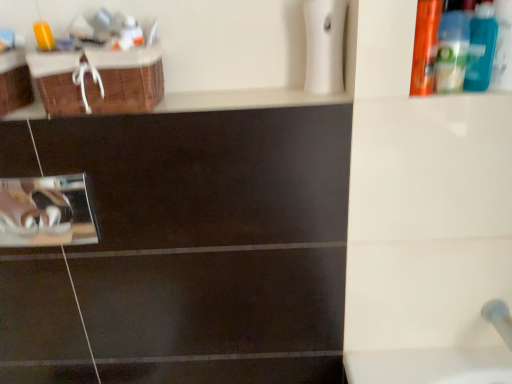
Question: Does translucent plastic mouthwash at upper left, positioned as the fourth mouthwash in right-to-left order, have a smaller size compared to blue plastic bottle at upper right, arranged as the first mouthwash when viewed from the right?

Choices:
 (A) no
 (B) yes

Answer: (B)

Question: Can you confirm if translucent plastic mouthwash at upper left, which ranks as the first mouthwash in left-to-right order, is wider than blue plastic bottle at upper right, the fourth mouthwash in the left-to-right sequence?

Choices:
 (A) yes
 (B) no

Answer: (B)

Question: Is translucent plastic mouthwash at upper left, which ranks as the first mouthwash in left-to-right order, at the left side of blue plastic bottle at upper right, the fourth mouthwash in the left-to-right sequence?

Choices:
 (A) no
 (B) yes

Answer: (B)

Question: Is translucent plastic mouthwash at upper left, which ranks as the first mouthwash in left-to-right order, facing away from blue plastic bottle at upper right, the fourth mouthwash in the left-to-right sequence?

Choices:
 (A) no
 (B) yes

Answer: (A)

Question: Is translucent plastic mouthwash at upper left, positioned as the fourth mouthwash in right-to-left order, far away from blue plastic bottle at upper right, arranged as the first mouthwash when viewed from the right?

Choices:
 (A) no
 (B) yes

Answer: (A)

Question: From a real-world perspective, is translucent plastic mouthwash at upper left, positioned as the fourth mouthwash in right-to-left order, positioned under blue plastic bottle at upper right, arranged as the first mouthwash when viewed from the right, based on gravity?

Choices:
 (A) no
 (B) yes

Answer: (A)

Question: Considering the relative positions of white glossy pipe at lower right and orange plastic bottle at upper right, the second mouthwash when ordered from left to right, in the image provided, is white glossy pipe at lower right to the left of orange plastic bottle at upper right, the second mouthwash when ordered from left to right, from the viewer's perspective?

Choices:
 (A) no
 (B) yes

Answer: (A)

Question: Considering the relative sizes of white glossy pipe at lower right and orange plastic bottle at upper right, the second mouthwash when ordered from left to right, in the image provided, is white glossy pipe at lower right smaller than orange plastic bottle at upper right, the second mouthwash when ordered from left to right,?

Choices:
 (A) yes
 (B) no

Answer: (B)

Question: From the image's perspective, is white glossy pipe at lower right beneath orange plastic bottle at upper right, which is the third mouthwash in right-to-left order?

Choices:
 (A) yes
 (B) no

Answer: (A)

Question: Is white glossy pipe at lower right thinner than orange plastic bottle at upper right, which is the third mouthwash in right-to-left order?

Choices:
 (A) yes
 (B) no

Answer: (B)

Question: Does white glossy pipe at lower right have a lesser height compared to orange plastic bottle at upper right, which is the third mouthwash in right-to-left order?

Choices:
 (A) no
 (B) yes

Answer: (B)

Question: Is white glossy pipe at lower right positioned beyond the bounds of orange plastic bottle at upper right, the second mouthwash when ordered from left to right?

Choices:
 (A) yes
 (B) no

Answer: (A)

Question: Could you tell me if blue plastic bottle at upper right, arranged as the first mouthwash when viewed from the right, is turned towards blue plastic bottle at upper right, the third mouthwash in the left-to-right sequence?

Choices:
 (A) no
 (B) yes

Answer: (A)